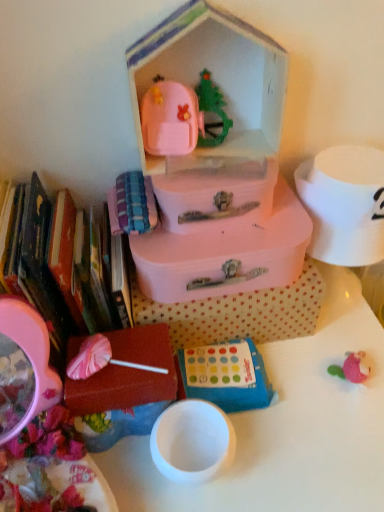
Where is `empty space that is ontop of white glossy table at center (from a real-world perspective)`? This screenshot has width=384, height=512. empty space that is ontop of white glossy table at center (from a real-world perspective) is located at coordinates (258, 409).